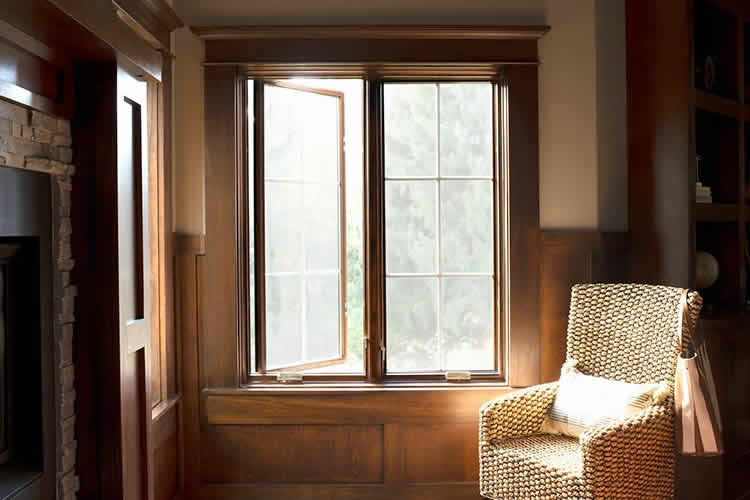
Locate an element on the screen. The width and height of the screenshot is (750, 500). mantle is located at coordinates (43, 140).